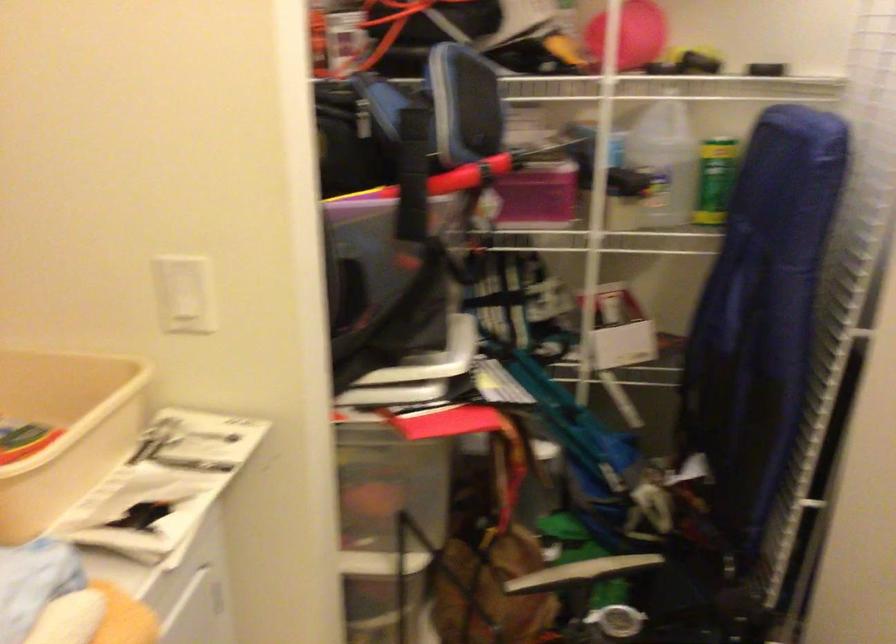
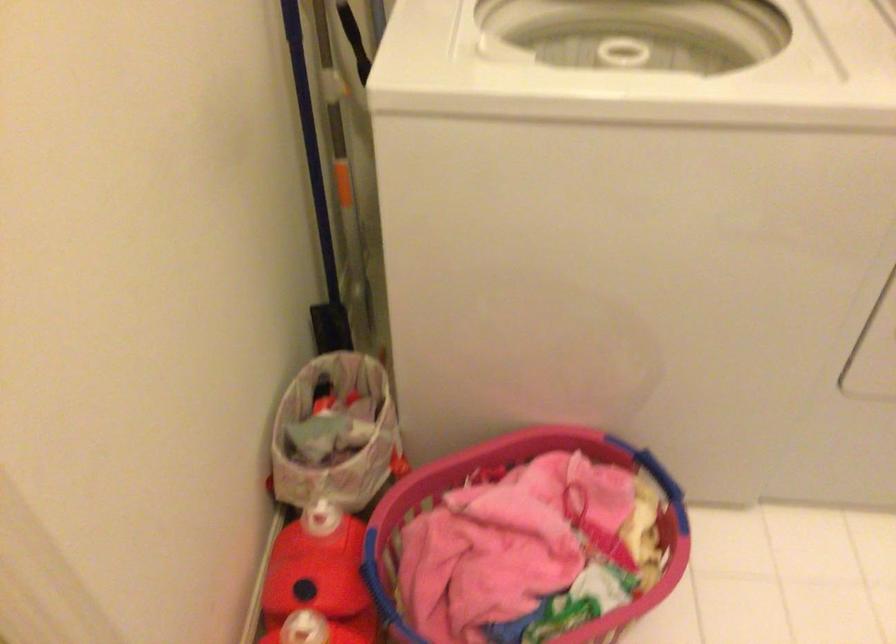
Based on the photo, the first image is from the beginning of the video and the second image is from the end. How did the camera likely rotate when shooting the video?

The camera rotated toward left-down.